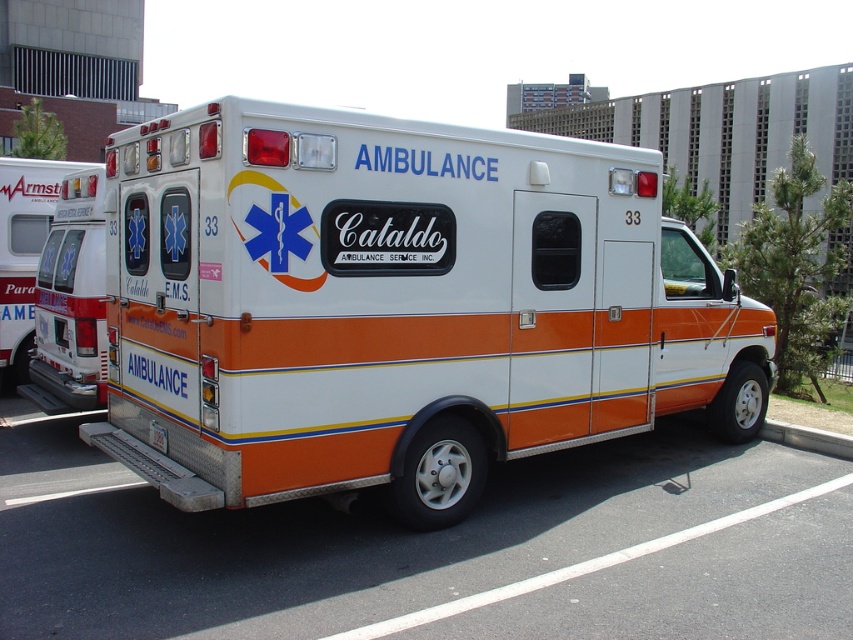
Does white glossy ambulance at center appear on the right side of white asphalt at lower center?

Yes, white glossy ambulance at center is to the right of white asphalt at lower center.

Can you confirm if white glossy ambulance at center is smaller than white asphalt at lower center?

No, white glossy ambulance at center is not smaller than white asphalt at lower center.

Is point (337, 490) positioned before point (711, 484)?

Yes, it is in front of point (711, 484).

Find the location of a particular element. white glossy ambulance at center is located at coordinates (x=398, y=307).

Does point (45, 621) lie in front of point (154, 429)?

Yes, point (45, 621) is closer to viewer.

Does white asphalt at lower center appear on the right side of white plastic license plate at lower center?

Indeed, white asphalt at lower center is positioned on the right side of white plastic license plate at lower center.

Image resolution: width=853 pixels, height=640 pixels. Identify the location of white asphalt at lower center. (338, 534).

Where is `white asphalt at lower center`? The height and width of the screenshot is (640, 853). white asphalt at lower center is located at coordinates (338, 534).

The image size is (853, 640). I want to click on gray concrete curb at lower right, so click(x=807, y=438).

Can you confirm if gray concrete curb at lower right is smaller than white plastic license plate at lower center?

No.

Identify the location of gray concrete curb at lower right. The image size is (853, 640). (807, 438).